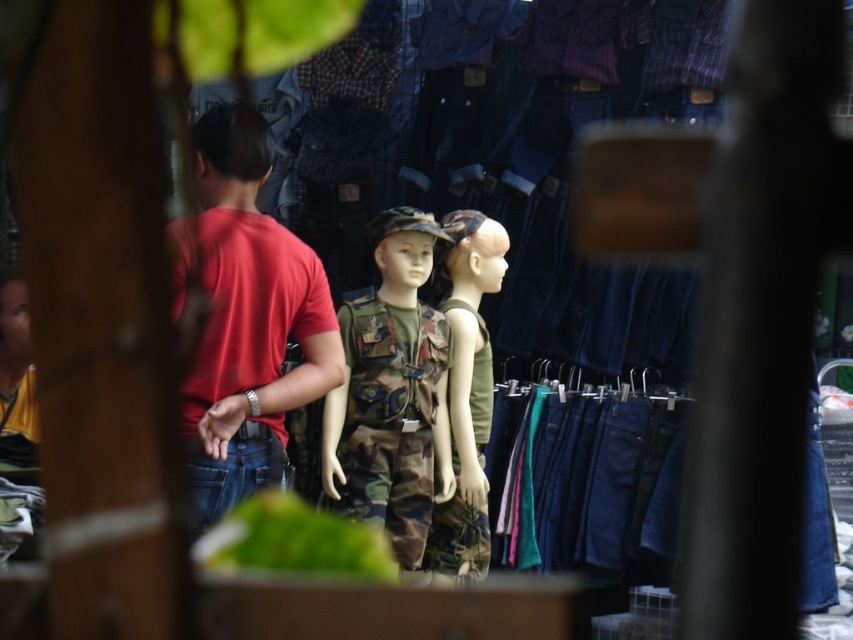
Question: Which object appears farthest from the camera in this image?

Choices:
 (A) red cotton t-shirt at center
 (B) camouflage fabric shirt at center
 (C) camo fabric vest at center

Answer: (B)

Question: Considering the real-world distances, which object is closest to the red cotton t-shirt at center?

Choices:
 (A) camo fabric vest at center
 (B) camouflage fabric shirt at center

Answer: (A)

Question: Considering the relative positions of camo fabric vest at center and camouflage fabric shirt at center in the image provided, where is camo fabric vest at center located with respect to camouflage fabric shirt at center?

Choices:
 (A) below
 (B) above

Answer: (B)

Question: In this image, where is red cotton t-shirt at center located relative to camouflage fabric shirt at center?

Choices:
 (A) left
 (B) right

Answer: (A)

Question: Is camo fabric vest at center to the left of camouflage fabric shirt at center from the viewer's perspective?

Choices:
 (A) yes
 (B) no

Answer: (A)

Question: Based on their relative distances, which object is farther from the camouflage fabric shirt at center?

Choices:
 (A) camo fabric vest at center
 (B) red cotton t-shirt at center

Answer: (B)